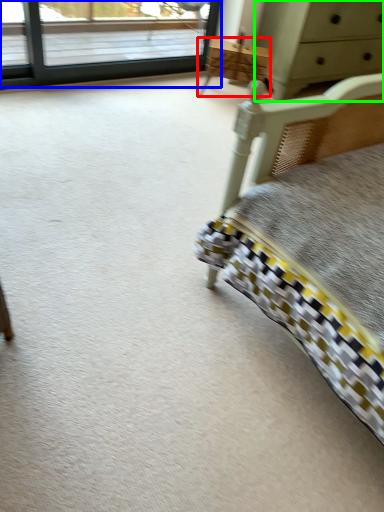
Question: Estimate the real-world distances between objects in this image. Which object is farther from furniture (highlighted by a red box), window (highlighted by a blue box) or chest of drawers (highlighted by a green box)?

Choices:
 (A) window
 (B) chest of drawers

Answer: (A)